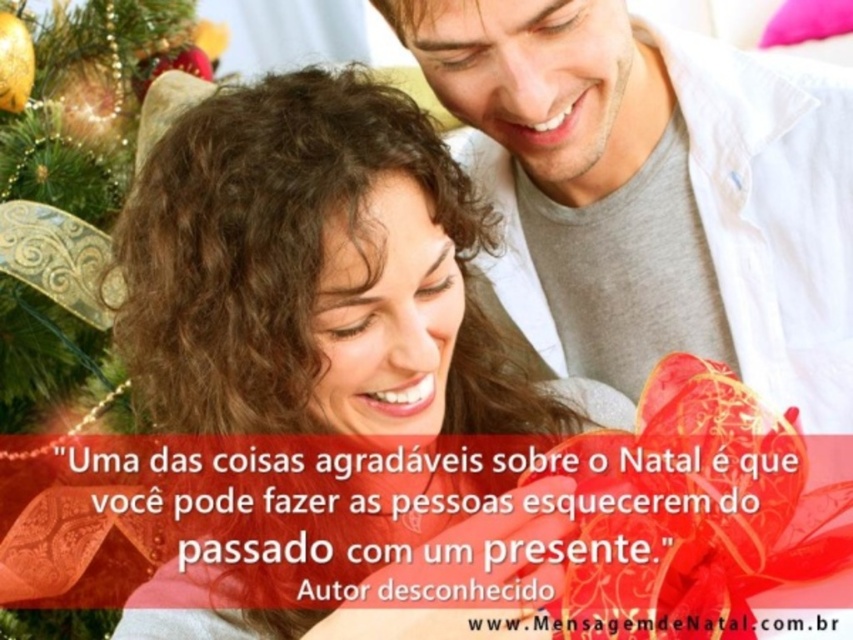
You are a photographer capturing this festive moment. You want to ensure both the white cotton shirt at upper right and the curly hair at center are in focus. Since the camera can only focus on one subject at a time, which subject should you prioritize focusing on to ensure the other remains in the background?

The white cotton shirt at upper right is positioned on the right side of curly hair at center. Therefore, if you focus on the curly hair at center, the white cotton shirt at upper right will naturally be in the background and still in focus due to its proximity.

You are a photographer trying to capture the perfect shot of the white cotton shirt at upper right and the curly hair at center. Which object should you focus on first if you want to ensure both are in sharp focus, considering their positions?

The white cotton shirt at upper right is taller than the curly hair at center, so focusing on the taller object first would help ensure both are in sharp focus.

You are standing in front of the festive scene and want to know which of the two points, point (204,196) or point (67,307), is nearer to you. Can you determine this based on their positions?

Point (204,196) is closer to the camera than point (67,307), so it is the nearer one to you.